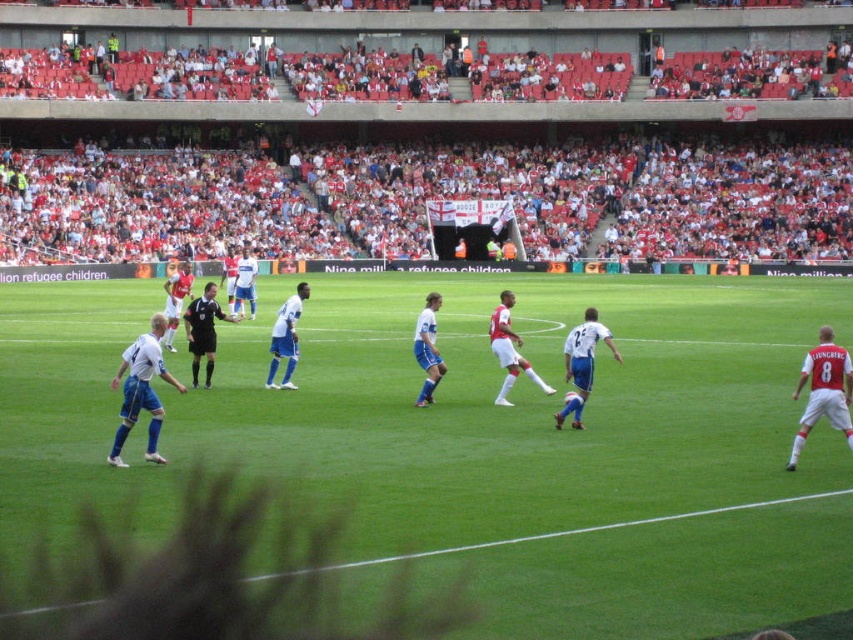
Find the location of a particular element. The width and height of the screenshot is (853, 640). white jersey at right is located at coordinates (822, 392).

Is white jersey at right positioned before black uniform at center?

Yes, white jersey at right is closer to the viewer.

Does point (810, 396) come farther from viewer compared to point (206, 337)?

No.

This screenshot has width=853, height=640. In order to click on white jersey at right in this screenshot , I will do `click(822, 392)`.

Is green grass football field at center above black uniform at center?

No.

Between green grass football field at center and black uniform at center, which one appears on the left side from the viewer's perspective?

Positioned to the left is black uniform at center.

Which is behind, point (369, 416) or point (212, 333)?

The point (212, 333) is more distant.

Image resolution: width=853 pixels, height=640 pixels. Find the location of `green grass football field at center`. green grass football field at center is located at coordinates (485, 440).

Which of these two, white smooth soccer player at center or blue jersey at center, stands taller?

blue jersey at center is taller.

Between white smooth soccer player at center and blue jersey at center, which one appears on the right side from the viewer's perspective?

white smooth soccer player at center is more to the right.

This screenshot has width=853, height=640. I want to click on white smooth soccer player at center, so click(582, 362).